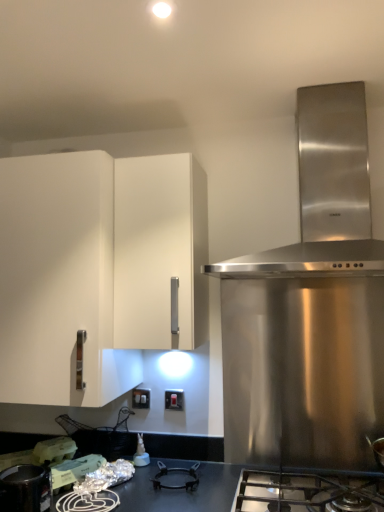
Find the location of a particular element. This screenshot has height=512, width=384. free location above stainless steel range hood at upper right (from a real-world perspective) is located at coordinates (291, 80).